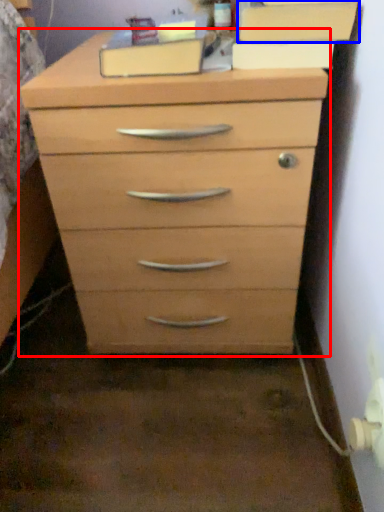
Question: Among these objects, which one is farthest to the camera, chest of drawers (highlighted by a red box) or cabinetry (highlighted by a blue box)?

Choices:
 (A) chest of drawers
 (B) cabinetry

Answer: (B)